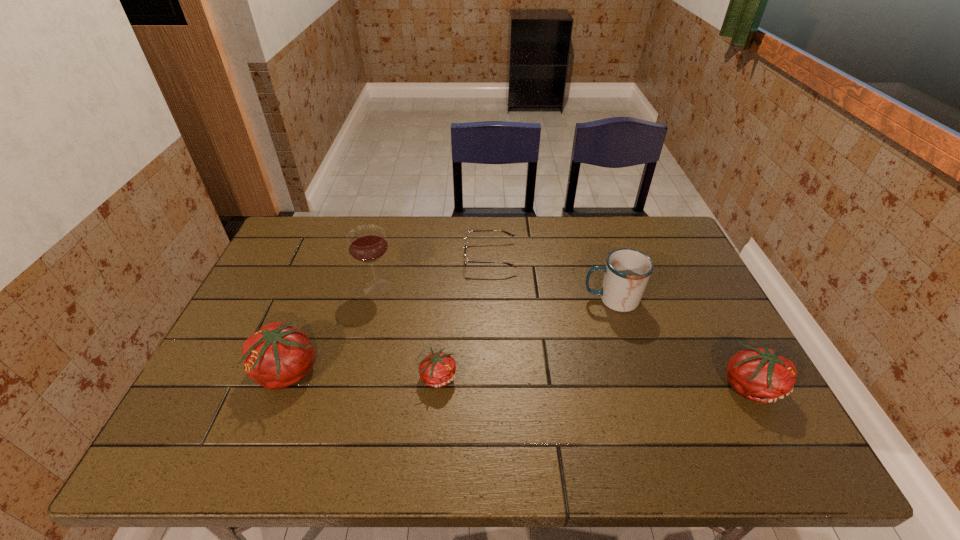
Find the location of a particular element. This screenshot has height=540, width=960. the third closest object to the leftmost tomato is located at coordinates (466, 261).

The height and width of the screenshot is (540, 960). What are the coordinates of `the closest tomato to the spectacles` in the screenshot? It's located at (438, 369).

Identify which tomato is the third nearest to the farthest object. Please provide its 2D coordinates. Your answer should be formatted as a tuple, i.e. [(x, y)], where the tuple contains the x and y coordinates of a point satisfying the conditions above.

[(762, 375)]

You are a GUI agent. You are given a task and a screenshot of the screen. Output one action in this format:
    pyautogui.click(x=<x>, y=<y>)
    Task: Click on the free point that satisfies the following two spatial constraints: 1. on the front-facing side of the rightmost tomato; 2. on the right side of the shortest object
    
    Given the screenshot: What is the action you would take?
    pyautogui.click(x=493, y=384)

Where is `free location that satisfies the following two spatial constraints: 1. on the front-facing side of the third shortest object; 2. on the right side of the fourth object from left to right`? Image resolution: width=960 pixels, height=540 pixels. free location that satisfies the following two spatial constraints: 1. on the front-facing side of the third shortest object; 2. on the right side of the fourth object from left to right is located at coordinates [x=493, y=384].

Where is `vacant space that satisfies the following two spatial constraints: 1. on the handle side of the rightmost object; 2. on the right side of the fifth object from left to right`? vacant space that satisfies the following two spatial constraints: 1. on the handle side of the rightmost object; 2. on the right side of the fifth object from left to right is located at coordinates (638, 384).

In order to click on free space that satisfies the following two spatial constraints: 1. on the front-facing side of the fourth object from left to right; 2. on the front side of the second tomato from right to left in this screenshot , I will do `click(492, 376)`.